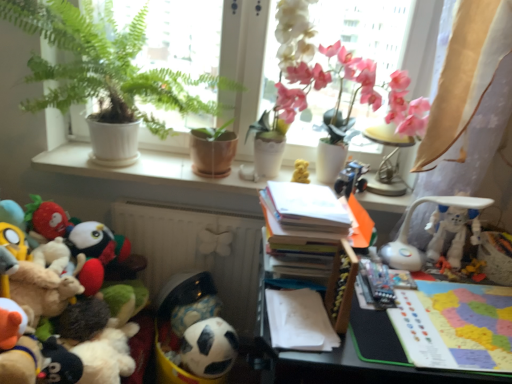
The image size is (512, 384). Identify the location of vacant space to the right of white plastic robot at right, the fifth toy when ordered from left to right. (476, 293).